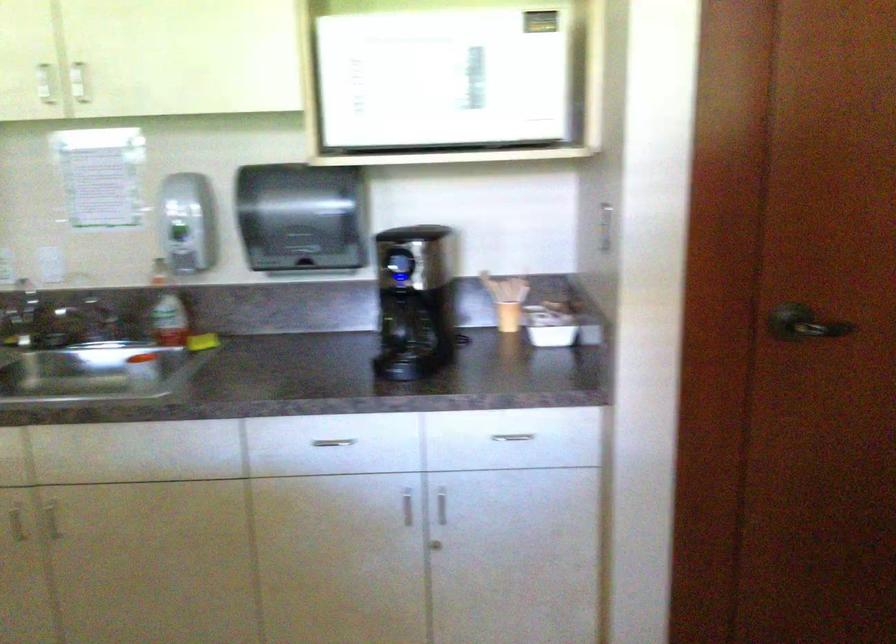
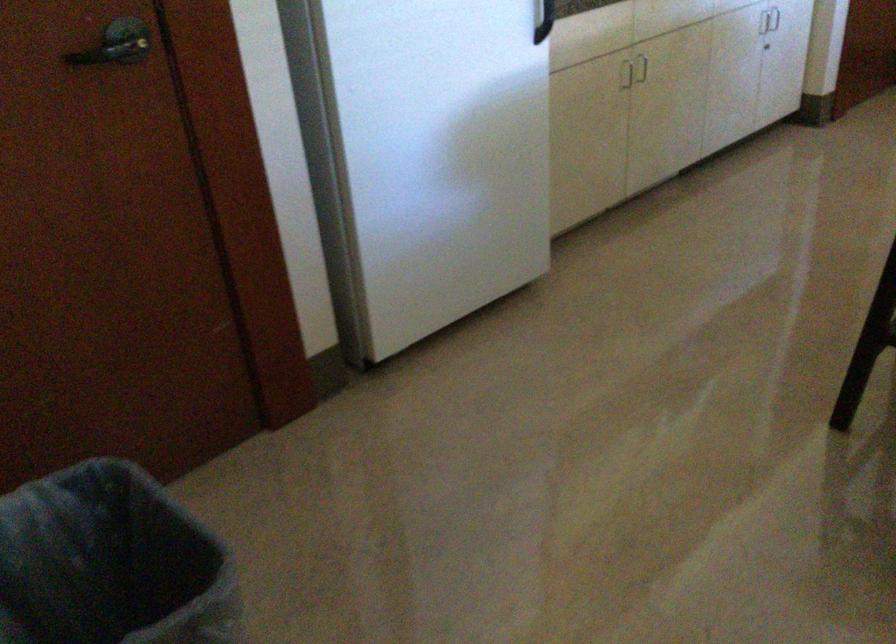
Locate, in the second image, the point that corresponds to point (364, 491) in the first image.

(769, 20)